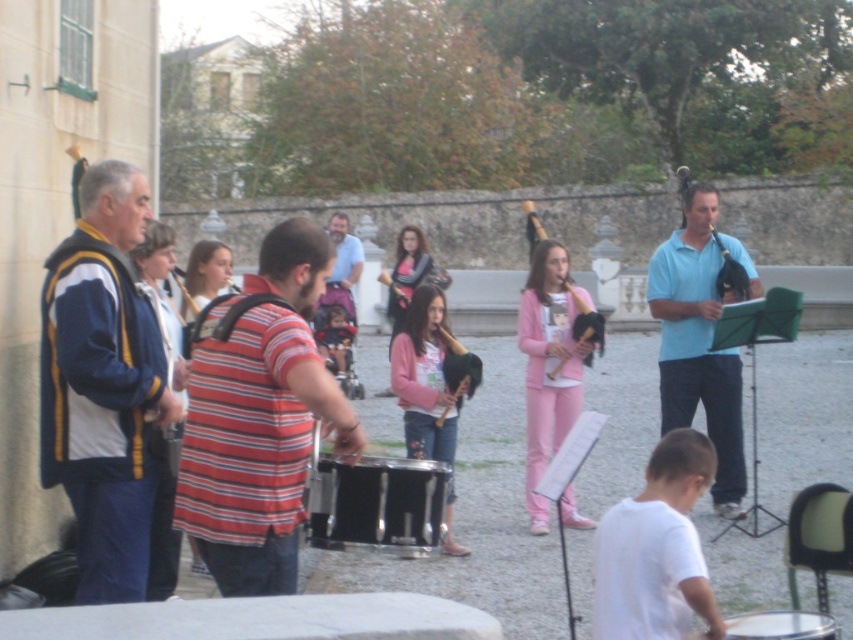
Question: Observing the image, what is the correct spatial positioning of striped cotton shirt at center in reference to black metallic drum at center?

Choices:
 (A) above
 (B) below

Answer: (A)

Question: Which point is farther to the camera?

Choices:
 (A) click(73, 496)
 (B) click(233, 493)
 (C) click(527, 243)

Answer: (C)

Question: Among these objects, which one is nearest to the camera?

Choices:
 (A) striped cotton shirt at center
 (B) white cotton shirt at lower center

Answer: (A)

Question: Is blue and yellow jacket at left closer to camera compared to wooden flute at center?

Choices:
 (A) yes
 (B) no

Answer: (A)

Question: From the image, what is the correct spatial relationship of blue and yellow jacket at left in relation to black drum at lower right?

Choices:
 (A) above
 (B) below

Answer: (A)

Question: Which object is closer to the camera taking this photo?

Choices:
 (A) blue smooth saxophone at center
 (B) black drum at lower right
 (C) blue and yellow jacket at left

Answer: (B)